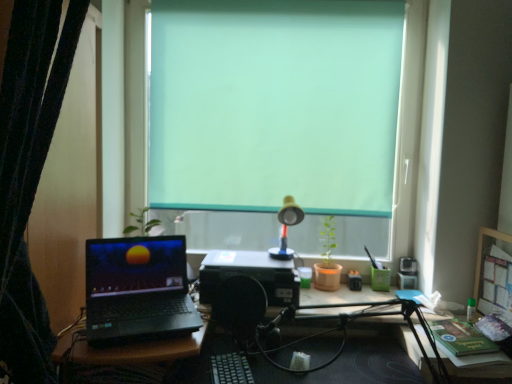
Question: Is point (418, 125) positioned closer to the camera than point (10, 203)?

Choices:
 (A) closer
 (B) farther

Answer: (B)

Question: Is teal matte window at center in front of or behind black fabric curtain at left in the image?

Choices:
 (A) behind
 (B) front

Answer: (A)

Question: Based on their sizes in the image, would you say teal matte window at center is bigger or smaller than black fabric curtain at left?

Choices:
 (A) small
 (B) big

Answer: (A)

Question: In terms of width, does black fabric curtain at left look wider or thinner when compared to teal matte window at center?

Choices:
 (A) thin
 (B) wide

Answer: (B)

Question: From the image's perspective, is black fabric curtain at left positioned above or below teal matte window at center?

Choices:
 (A) below
 (B) above

Answer: (A)

Question: Considering the positions of point (13, 18) and point (409, 99), is point (13, 18) closer or farther from the camera than point (409, 99)?

Choices:
 (A) closer
 (B) farther

Answer: (A)

Question: From a real-world perspective, is black fabric curtain at left positioned above or below teal matte window at center?

Choices:
 (A) above
 (B) below

Answer: (B)